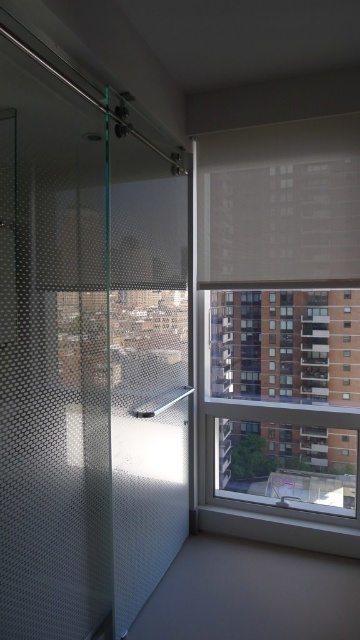
Question: Is frosted glass door at left bigger than white matte blind at upper center?

Choices:
 (A) no
 (B) yes

Answer: (B)

Question: Is frosted glass door at left below satin nickel shower at center?

Choices:
 (A) yes
 (B) no

Answer: (B)

Question: Considering the real-world distances, which object is farthest from the clear glass window at upper right?

Choices:
 (A) frosted glass door at left
 (B) white matte blind at upper center
 (C) satin nickel shower at center

Answer: (A)

Question: Which is nearer to the white matte blind at upper center?

Choices:
 (A) frosted glass door at left
 (B) clear glass window at upper right
 (C) satin nickel shower at center

Answer: (B)

Question: Which of the following is the farthest from the observer?

Choices:
 (A) (263, 445)
 (B) (289, 193)
 (C) (176, 396)

Answer: (A)

Question: Can you confirm if frosted glass door at left is positioned to the left of clear glass window at upper right?

Choices:
 (A) yes
 (B) no

Answer: (A)